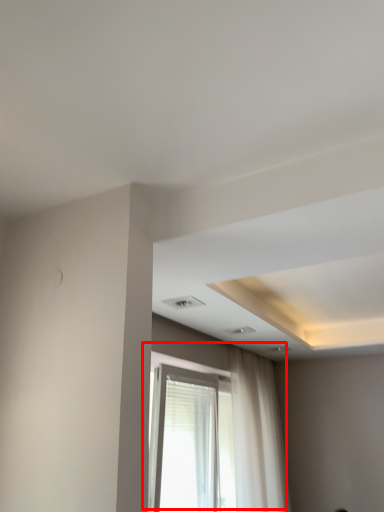
Question: From the image's perspective, what is the correct spatial positioning of window (annotated by the red box) in reference to curtain?

Choices:
 (A) below
 (B) above

Answer: (B)